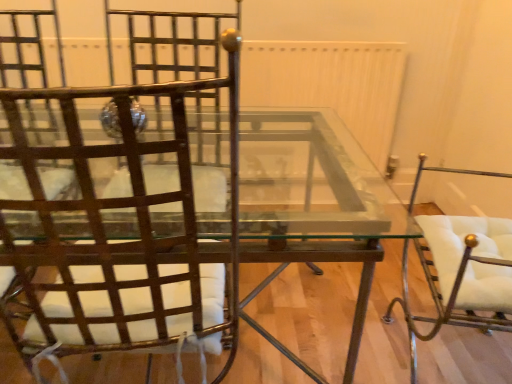
Question: Is white leather chair at right, which is counted as the second chair, starting from the left, at the right side of metallic brown chair at left, acting as the second chair starting from the right?

Choices:
 (A) no
 (B) yes

Answer: (B)

Question: Considering the relative sizes of white leather chair at right, which is counted as the second chair, starting from the left, and metallic brown chair at left, marked as the 1th chair in a left-to-right arrangement, in the image provided, is white leather chair at right, which is counted as the second chair, starting from the left, bigger than metallic brown chair at left, marked as the 1th chair in a left-to-right arrangement,?

Choices:
 (A) no
 (B) yes

Answer: (A)

Question: Is the position of white leather chair at right, which is counted as the first chair, starting from the right, more distant than that of metallic brown chair at left, marked as the 1th chair in a left-to-right arrangement?

Choices:
 (A) no
 (B) yes

Answer: (B)

Question: Can you confirm if white leather chair at right, which is counted as the first chair, starting from the right, is thinner than metallic brown chair at left, acting as the second chair starting from the right?

Choices:
 (A) yes
 (B) no

Answer: (A)

Question: Would you say white leather chair at right, which is counted as the second chair, starting from the left, contains metallic brown chair at left, marked as the 1th chair in a left-to-right arrangement?

Choices:
 (A) yes
 (B) no

Answer: (B)

Question: Looking at the image, does white leather chair at right, which is counted as the first chair, starting from the right, seem bigger or smaller compared to clear glass table at center?

Choices:
 (A) small
 (B) big

Answer: (A)

Question: Considering the relative positions of white leather chair at right, which is counted as the first chair, starting from the right, and clear glass table at center in the image provided, is white leather chair at right, which is counted as the first chair, starting from the right, to the left or to the right of clear glass table at center?

Choices:
 (A) left
 (B) right

Answer: (B)

Question: Looking at their shapes, would you say white leather chair at right, which is counted as the first chair, starting from the right, is wider or thinner than clear glass table at center?

Choices:
 (A) wide
 (B) thin

Answer: (B)

Question: Would you say white leather chair at right, which is counted as the second chair, starting from the left, is inside or outside clear glass table at center?

Choices:
 (A) inside
 (B) outside

Answer: (B)

Question: Is metallic brown chair at left, marked as the 1th chair in a left-to-right arrangement, bigger or smaller than clear glass table at center?

Choices:
 (A) big
 (B) small

Answer: (B)

Question: Considering the positions of point (61, 292) and point (369, 264), is point (61, 292) closer or farther from the camera than point (369, 264)?

Choices:
 (A) closer
 (B) farther

Answer: (B)

Question: Is metallic brown chair at left, acting as the second chair starting from the right, wider or thinner than clear glass table at center?

Choices:
 (A) thin
 (B) wide

Answer: (A)

Question: In the image, is metallic brown chair at left, acting as the second chair starting from the right, on the left side or the right side of clear glass table at center?

Choices:
 (A) left
 (B) right

Answer: (A)

Question: Is clear glass table at center spatially inside metallic brown chair at left, marked as the 1th chair in a left-to-right arrangement, or outside of it?

Choices:
 (A) outside
 (B) inside

Answer: (A)

Question: From the image's perspective, is clear glass table at center located above or below metallic brown chair at left, acting as the second chair starting from the right?

Choices:
 (A) below
 (B) above

Answer: (A)